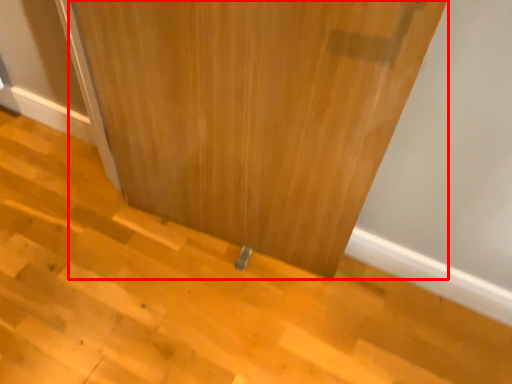
Question: From the image's perspective, where is door (annotated by the red box) located in relation to stair in the image?

Choices:
 (A) below
 (B) above

Answer: (B)